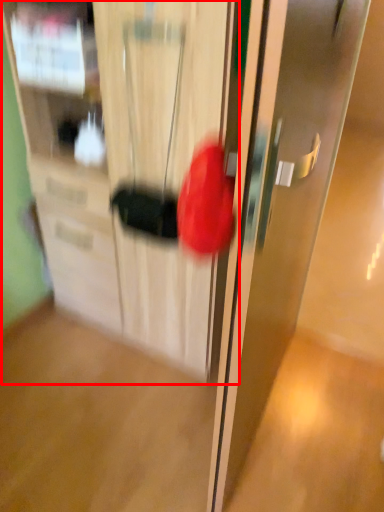
Question: From the image's perspective, what is the correct spatial relationship of cabinetry (annotated by the red box) in relation to door?

Choices:
 (A) below
 (B) above

Answer: (B)